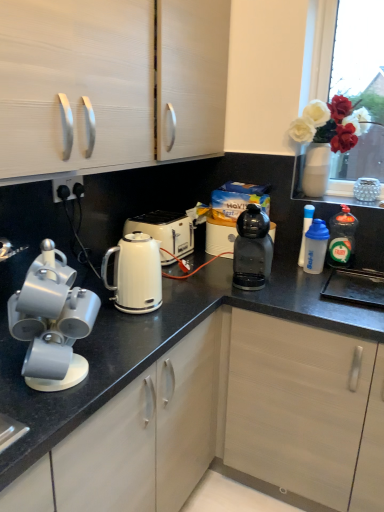
Question: Based on their sizes in the image, would you say black plastic coffee machine at center, the fourth kitchen appliance when ordered from right to left, is bigger or smaller than translucent plastic dishwashing liquid at right, the 1th kitchen appliance in the right-to-left sequence?

Choices:
 (A) small
 (B) big

Answer: (B)

Question: In the image, is black plastic coffee machine at center, the fourth kitchen appliance when ordered from right to left, on the left side or the right side of translucent plastic dishwashing liquid at right, which ranks as the fifth kitchen appliance in left-to-right order?

Choices:
 (A) right
 (B) left

Answer: (B)

Question: Estimate the real-world distances between objects in this image. Which object is farther from the translucent plastic water bottle at right, which appears as the fourth kitchen appliance when viewed from the left?

Choices:
 (A) white plastic water bottle at right, the 3th kitchen appliance positioned from the right
 (B) white plastic toaster at upper center
 (C) matte gray mugs at left
 (D) white glossy kettle at center
 (E) white glossy electric kettle at center, marked as the fifth kitchen appliance in a right-to-left arrangement

Answer: (C)

Question: Which object is positioned farthest from the black plastic socket at lower left?

Choices:
 (A) matte white cabinet at upper left
 (B) white plastic toaster at upper center
 (C) black plastic coffee machine at center
 (D) white plastic water bottle at right, the 3th kitchen appliance from the left
 (E) white glossy kettle at center

Answer: (D)